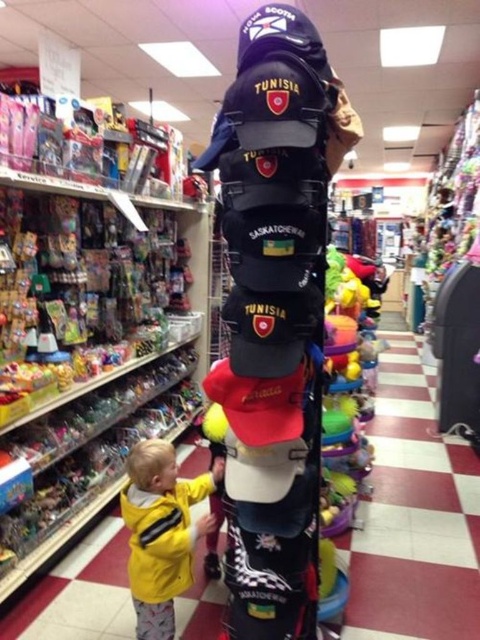
You are a store employee who needs to restock the yellow matte jacket at lower left. The store has a rule that items must be placed in front of other items if they are seasonal. Since the jacket is seasonal, where should you place it relative to the smooth plastic toys at center?

The yellow matte jacket at lower left should be placed in front of the smooth plastic toys at center because it is seasonal and the store rule requires seasonal items to be placed in front.

You are standing in a toy store and want to reach a hat displayed at point (477, 570). If your arm can extend 2 meters, can you reach the hat?

The distance of point (477, 570) from the viewer is 2.53 meters, so your arm can only extend 2 meters, meaning you cannot reach the hat.